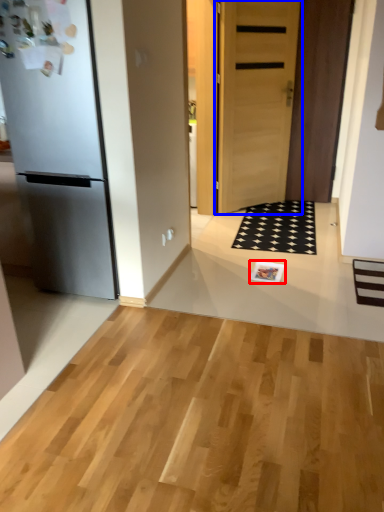
Question: Which point is closer to the camera, magazine (highlighted by a red box) or door (highlighted by a blue box)?

Choices:
 (A) magazine
 (B) door

Answer: (A)